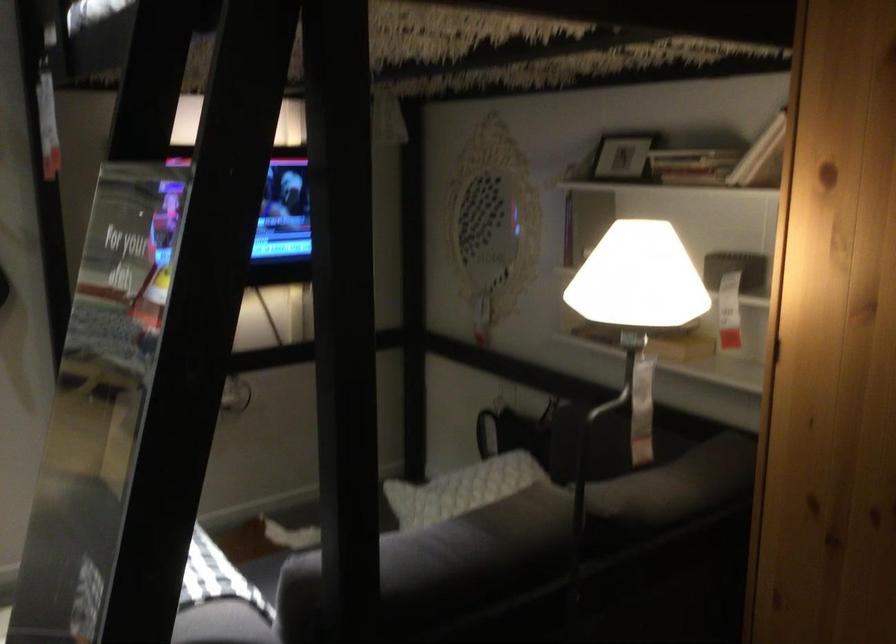
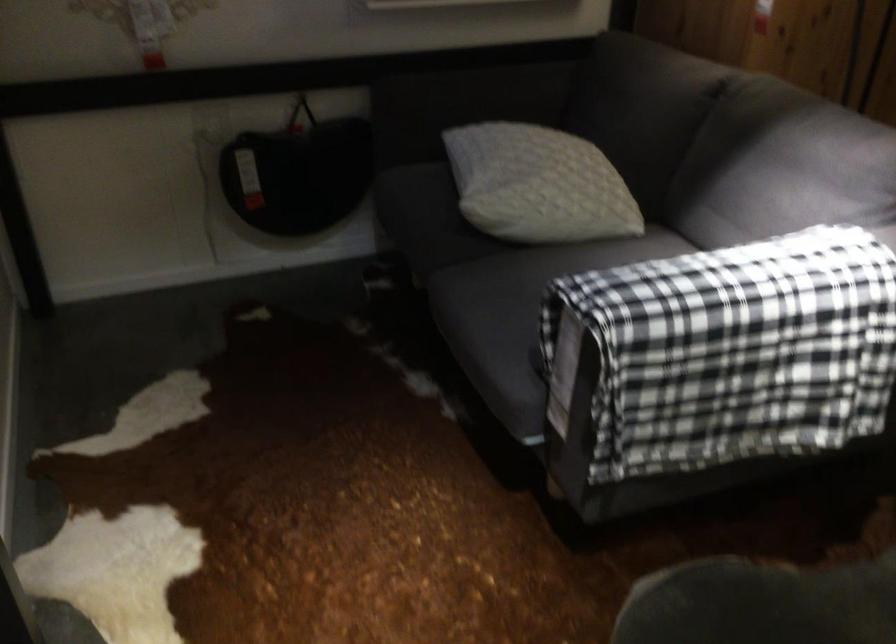
The point at (600, 444) is marked in the first image. Where is the corresponding point in the second image?

(478, 98)